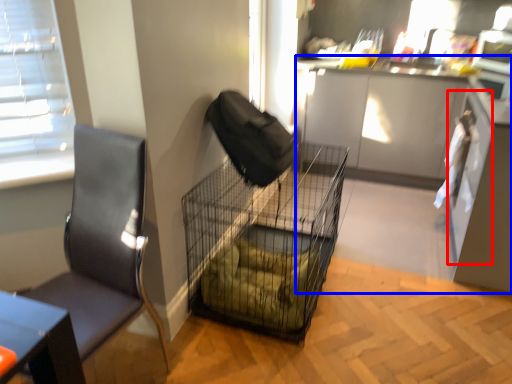
Question: Which object is closer to the camera taking this photo, screen door (highlighted by a red box) or cabinetry (highlighted by a blue box)?

Choices:
 (A) screen door
 (B) cabinetry

Answer: (B)